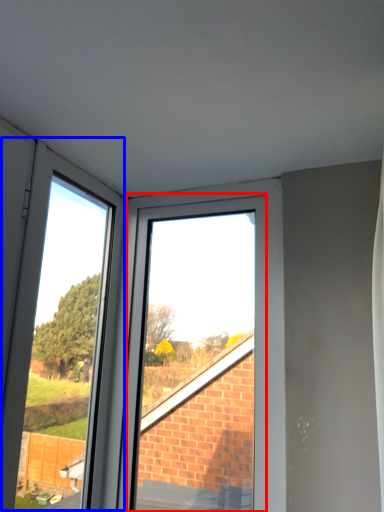
Question: Which object is further to the camera taking this photo, bay window (highlighted by a red box) or glass door (highlighted by a blue box)?

Choices:
 (A) bay window
 (B) glass door

Answer: (A)